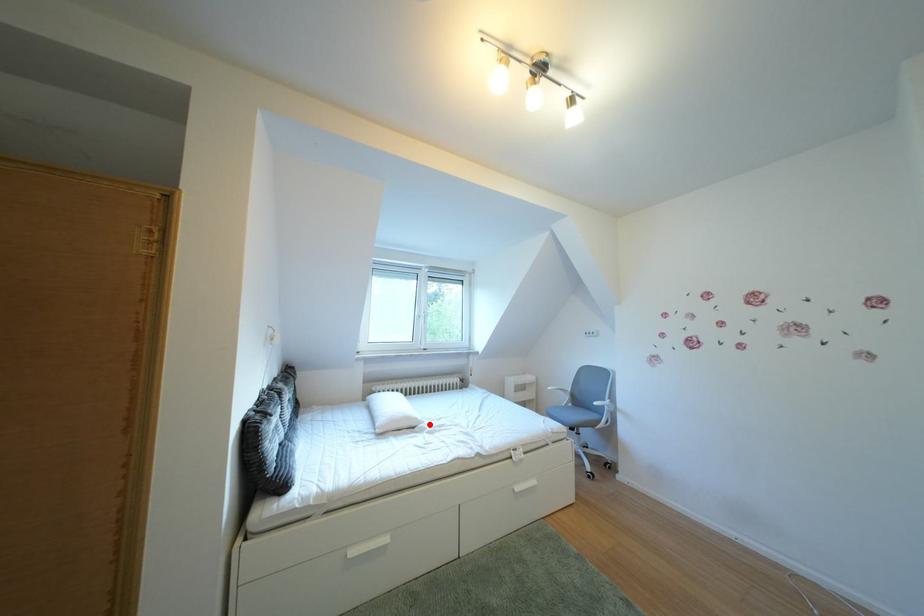
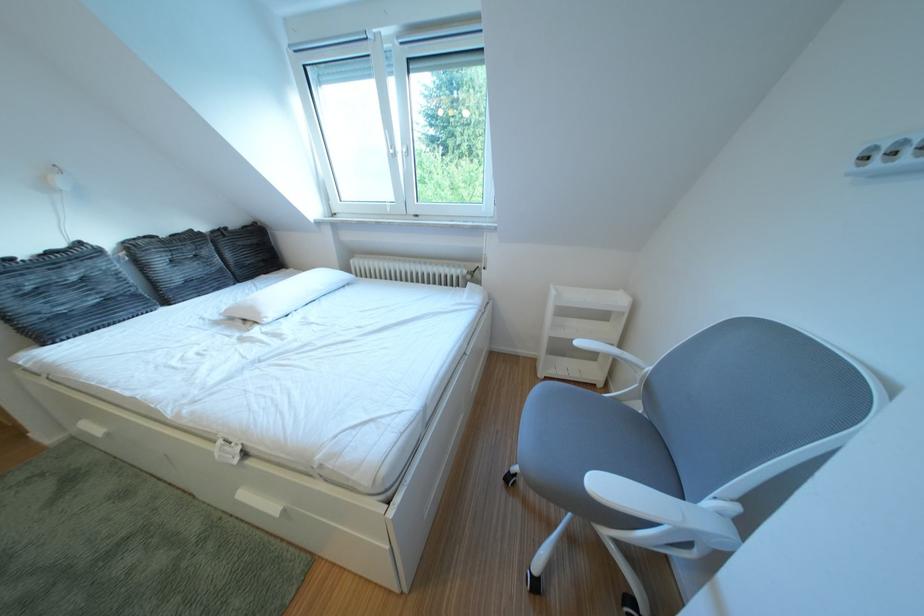
Locate, in the second image, the point that corresponds to the highlighted location in the first image.

(273, 318)